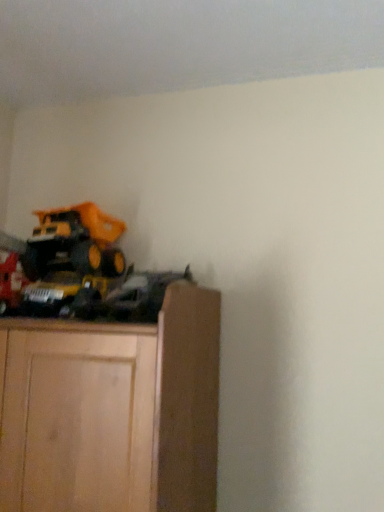
The height and width of the screenshot is (512, 384). What do you see at coordinates (75, 242) in the screenshot?
I see `yellow plastic toy truck at upper left` at bounding box center [75, 242].

At what (x,y) coordinates should I click in order to perform the action: click on yellow plastic toy truck at upper left. Please return your answer as a coordinate pair (x, y). Looking at the image, I should click on (75, 242).

The image size is (384, 512). Find the location of `matte black train at left`. matte black train at left is located at coordinates (11, 282).

What do you see at coordinates (11, 282) in the screenshot?
I see `matte black train at left` at bounding box center [11, 282].

What is the approximate height of matte black train at left?

It is 9.30 inches.

Identify the location of yellow plastic toy truck at upper left. The image size is (384, 512). (75, 242).

Considering the positions of objects matte black train at left and yellow plastic toy truck at upper left in the image provided, who is more to the right, matte black train at left or yellow plastic toy truck at upper left?

yellow plastic toy truck at upper left is more to the right.

Is matte black train at left behind yellow plastic toy truck at upper left?

No, it is in front of yellow plastic toy truck at upper left.

Is point (17, 277) positioned behind point (56, 267)?

No, it is not.

From the image's perspective, is matte black train at left on yellow plastic toy truck at upper left?

Incorrect, from the image's perspective, matte black train at left is lower than yellow plastic toy truck at upper left.

From a real-world perspective, relative to yellow plastic toy truck at upper left, is matte black train at left vertically above or below?

In terms of real-world spatial position, matte black train at left is below yellow plastic toy truck at upper left.

Can you confirm if matte black train at left is wider than yellow plastic toy truck at upper left?

In fact, matte black train at left might be narrower than yellow plastic toy truck at upper left.

Consider the image. Can you confirm if matte black train at left is shorter than yellow plastic toy truck at upper left?

Indeed, matte black train at left has a lesser height compared to yellow plastic toy truck at upper left.

Between matte black train at left and yellow plastic toy truck at upper left, which one has larger size?

yellow plastic toy truck at upper left.

Which is correct: matte black train at left is inside yellow plastic toy truck at upper left, or outside of it?

matte black train at left is spatially situated outside yellow plastic toy truck at upper left.

Is matte black train at left placed right next to yellow plastic toy truck at upper left?

matte black train at left and yellow plastic toy truck at upper left are clearly separated.

Could you tell me if matte black train at left is turned towards yellow plastic toy truck at upper left?

No.

How many degrees apart are the facing directions of matte black train at left and yellow plastic toy truck at upper left?

The facing directions of matte black train at left and yellow plastic toy truck at upper left are 2.45 degrees apart.

At what (x,y) coordinates should I click in order to perform the action: click on toy that is in front of the yellow plastic toy truck at upper left. Please return your answer as a coordinate pair (x, y). Looking at the image, I should click on point(11,282).

Considering the relative positions of yellow plastic toy truck at upper left and matte black train at left in the image provided, is yellow plastic toy truck at upper left to the right of matte black train at left from the viewer's perspective?

Yes.

From the picture: Considering their positions, is yellow plastic toy truck at upper left located in front of or behind matte black train at left?

yellow plastic toy truck at upper left is positioned farther from the viewer than matte black train at left.

Between point (76, 210) and point (9, 287), which one is positioned behind?

Positioned behind is point (76, 210).

From the image's perspective, which one is positioned higher, yellow plastic toy truck at upper left or matte black train at left?

From the image's view, yellow plastic toy truck at upper left is above.

From a real-world perspective, between yellow plastic toy truck at upper left and matte black train at left, who is vertically higher?

yellow plastic toy truck at upper left, from a real-world perspective.

Can you confirm if yellow plastic toy truck at upper left is thinner than matte black train at left?

No.

Considering the sizes of objects yellow plastic toy truck at upper left and matte black train at left in the image provided, who is taller, yellow plastic toy truck at upper left or matte black train at left?

yellow plastic toy truck at upper left is taller.

Looking at this image, is yellow plastic toy truck at upper left smaller than matte black train at left?

No, yellow plastic toy truck at upper left is not smaller than matte black train at left.

Is matte black train at left inside yellow plastic toy truck at upper left?

Definitely not — matte black train at left is not inside yellow plastic toy truck at upper left.

Is yellow plastic toy truck at upper left placed right next to matte black train at left?

There is a gap between yellow plastic toy truck at upper left and matte black train at left.

Consider the image. Is matte black train at left at the back of yellow plastic toy truck at upper left?

yellow plastic toy truck at upper left is not turned away from matte black train at left.

How many degrees apart are the facing directions of yellow plastic toy truck at upper left and matte black train at left?

2.45 degrees.

Find the location of `toy on the left of yellow plastic toy truck at upper left`. toy on the left of yellow plastic toy truck at upper left is located at coordinates (11, 282).

Where is `equipment that appears on the right of matte black train at left`? equipment that appears on the right of matte black train at left is located at coordinates (75, 242).

This screenshot has width=384, height=512. Identify the location of equipment that is above the matte black train at left (from a real-world perspective). 75,242.